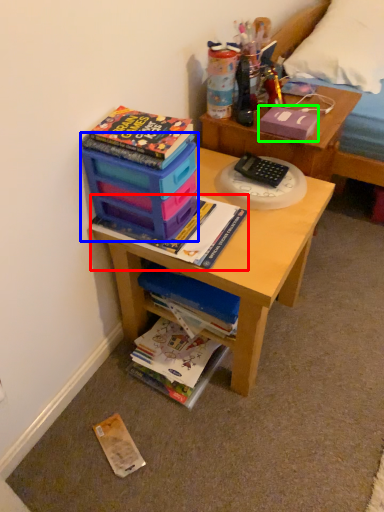
Question: Which object is positioned closest to book (highlighted by a red box)? Select from storage box (highlighted by a blue box) and paperback book (highlighted by a green box).

Choices:
 (A) storage box
 (B) paperback book

Answer: (A)